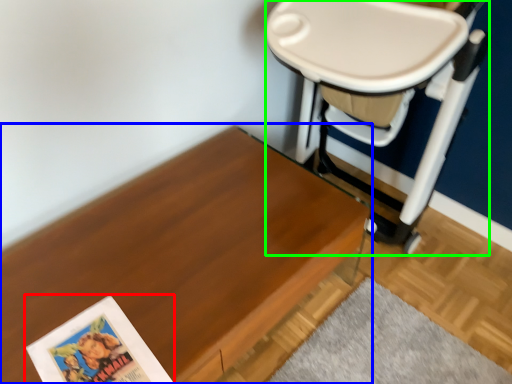
Question: Considering the real-world distances, which object is closest to paperback book (highlighted by a red box)? table (highlighted by a blue box) or swivel chair (highlighted by a green box).

Choices:
 (A) table
 (B) swivel chair

Answer: (A)